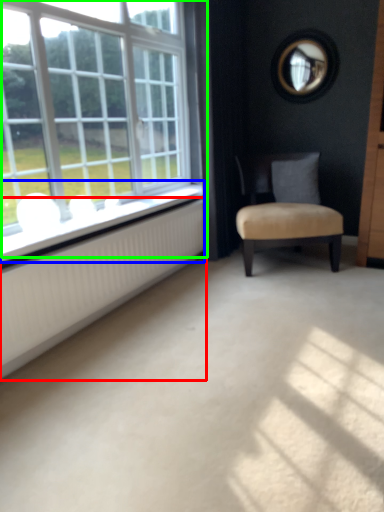
Question: Estimate the real-world distances between objects in this image. Which object is farther from radiator (highlighted by a red box), window sill (highlighted by a blue box) or window (highlighted by a green box)?

Choices:
 (A) window sill
 (B) window

Answer: (B)